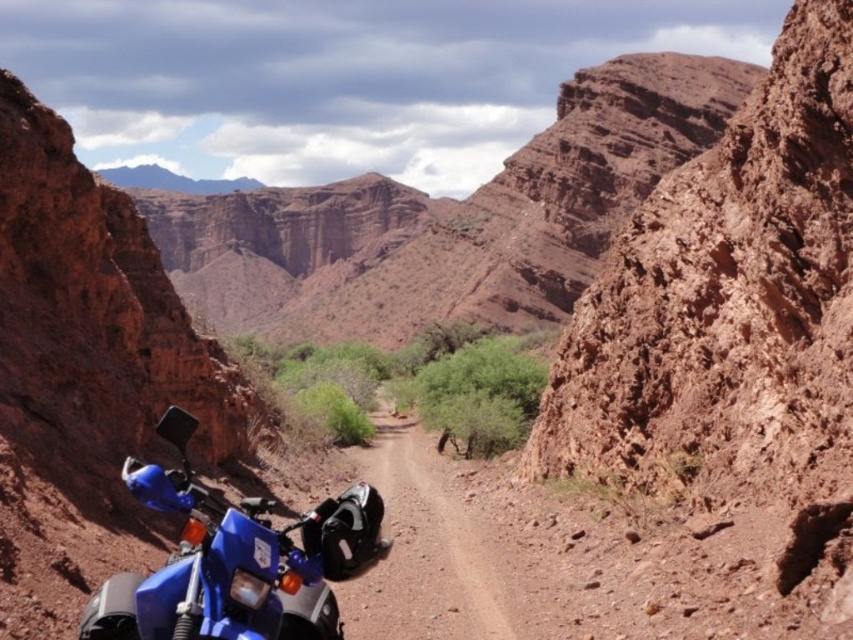
You are standing at the blue motorcycle parked on the left side of the path in the desert canyon. You need to reach the point marked at coordinate (448, 220). According to the image, which direction should you head from the blue motorcycle to reach that point?

The point at coordinate (448, 220) is located on the rustic rock formation at center. From the blue motorcycle parked on the left side of the path, you should head towards the center of the canyon to reach that point.